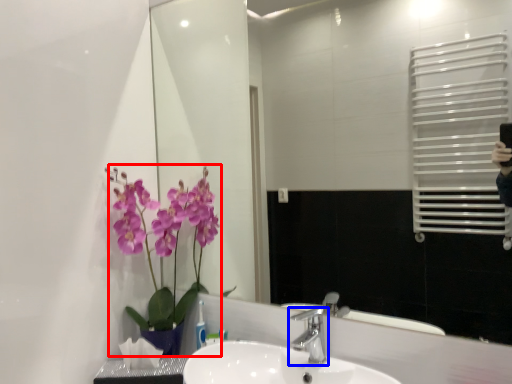
Question: Which object appears farthest to the camera in this image, floral arrangement (highlighted by a red box) or tap (highlighted by a blue box)?

Choices:
 (A) floral arrangement
 (B) tap

Answer: (A)